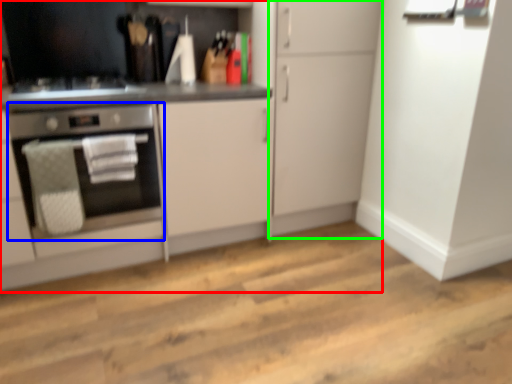
Question: Considering the real-world distances, which object is closest to cabinetry (highlighted by a red box)? home appliance (highlighted by a blue box) or cabinetry (highlighted by a green box).

Choices:
 (A) home appliance
 (B) cabinetry

Answer: (B)